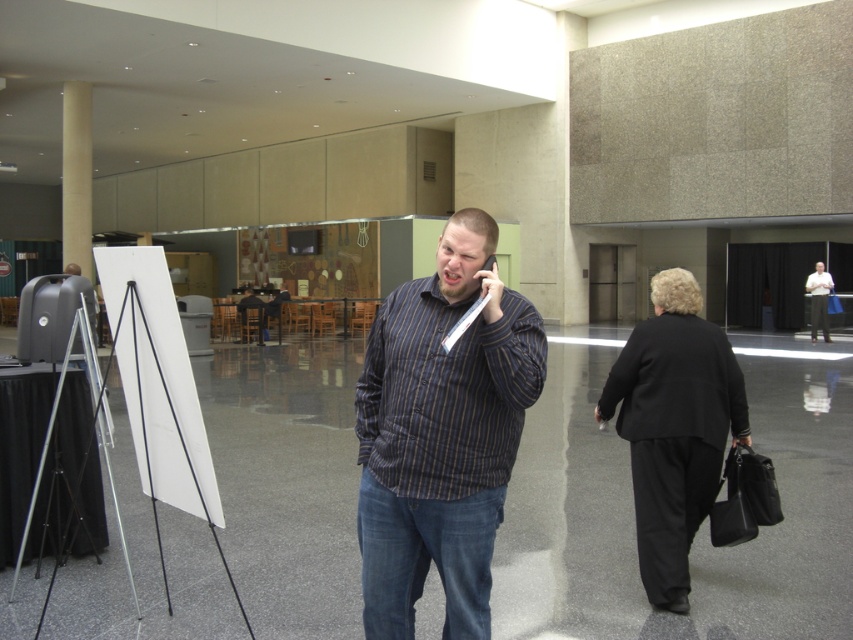
Question: Can you confirm if beige concrete pillar at left is smaller than dark blue striped shirt at center?

Choices:
 (A) no
 (B) yes

Answer: (A)

Question: Is beige concrete pillar at left to the right of striped shirt at center from the viewer's perspective?

Choices:
 (A) no
 (B) yes

Answer: (A)

Question: Which object is closer to the camera taking this photo?

Choices:
 (A) striped shirt at center
 (B) striped cotton shirt at center

Answer: (B)

Question: Can you confirm if striped cotton shirt at center is smaller than dark blue striped shirt at center?

Choices:
 (A) no
 (B) yes

Answer: (A)

Question: Which point appears closest to the camera in this image?

Choices:
 (A) (115, 320)
 (B) (815, 310)
 (C) (480, 545)

Answer: (C)

Question: Which point is closer to the camera?

Choices:
 (A) (427, 492)
 (B) (245, 305)
 (C) (68, 202)

Answer: (A)